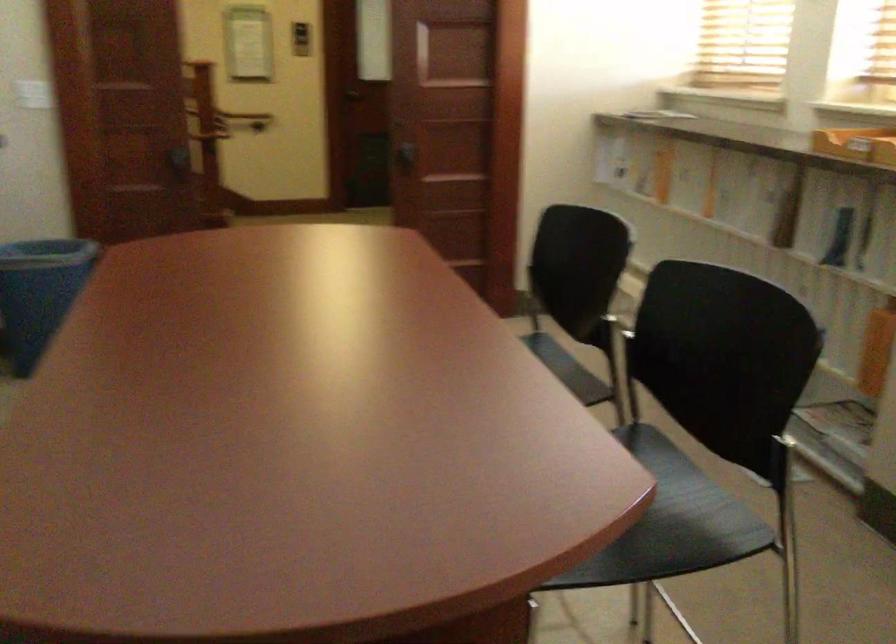
I want to click on blue trash can, so click(x=39, y=294).